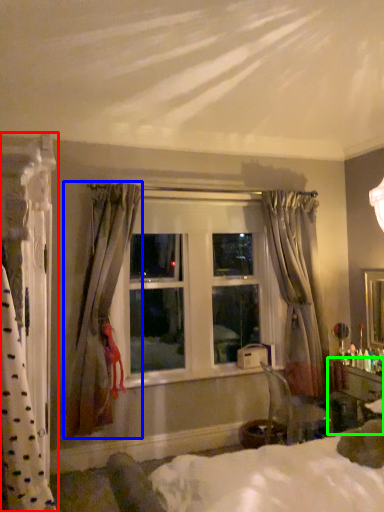
Question: Considering the real-world distances, which object is closest to curtain (highlighted by a red box)? curtain (highlighted by a blue box) or vanity (highlighted by a green box).

Choices:
 (A) curtain
 (B) vanity

Answer: (A)